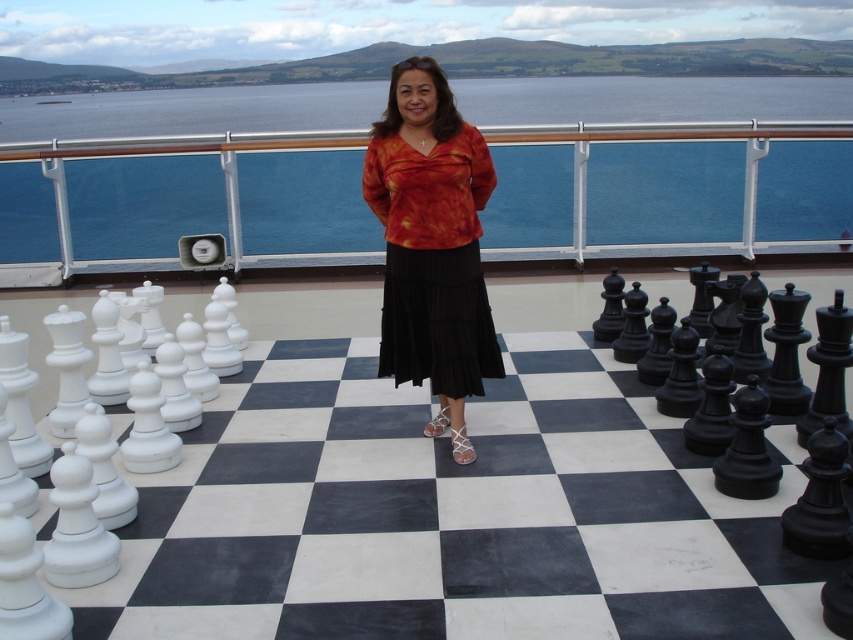
You are a photographer trying to capture the entire white glossy chessboard at center and blue water at upper center in one shot. Based on their sizes, which object should you focus on to ensure both are visible without cropping?

The white glossy chessboard at center is smaller than the blue water at upper center. To ensure both are visible, focus on the white glossy chessboard at center since it is narrower and adjust the camera angle to include the wider blue water at upper center.

What is the significance of the point at coordinates (450, 513) in the image?

The point at coordinates (450, 513) marks the location of the white glossy chessboard at center.

You are navigating a drone over the cruise ship deck and need to drop a small flag exactly at the center of the white glossy chessboard at center. According to the coordinates provided, where should you aim the drone to drop the flag?

The white glossy chessboard at center is located at point (450, 513), so you should aim the drone to drop the flag at those coordinates.